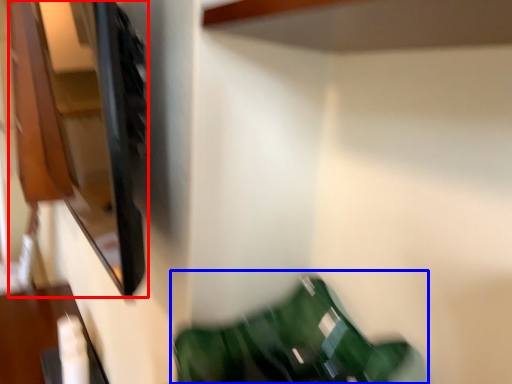
Question: Which object is further to the camera taking this photo, cabinet (highlighted by a red box) or bean bag chair (highlighted by a blue box)?

Choices:
 (A) cabinet
 (B) bean bag chair

Answer: (A)